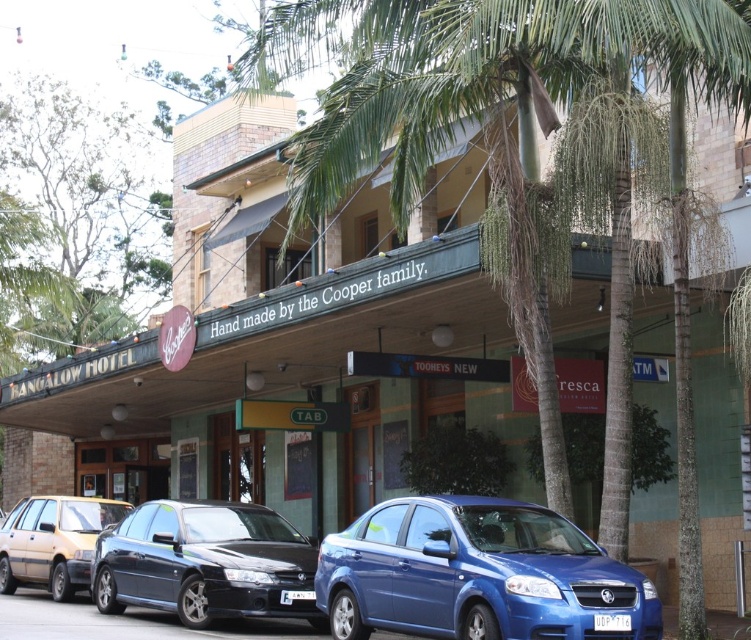
Question: Which point is farther to the camera?

Choices:
 (A) white plastic license plate at center
 (B) white plastic license plate at lower center
 (C) glossy blue sedan at lower center

Answer: (A)

Question: Observing the image, what is the correct spatial positioning of green leafy palm tree at center in reference to matte beige sedan at lower left?

Choices:
 (A) below
 (B) above

Answer: (B)

Question: Which of the following is the farthest from the observer?

Choices:
 (A) (154, 577)
 (B) (572, 120)
 (C) (311, 589)
 (D) (614, 618)

Answer: (A)

Question: Is green leafy palm tree at center wider than white plastic license plate at lower center?

Choices:
 (A) yes
 (B) no

Answer: (A)

Question: Which point appears farthest from the camera in this image?

Choices:
 (A) (252, 602)
 (B) (300, 600)
 (C) (44, 508)
 (D) (617, 627)

Answer: (C)

Question: From the image, what is the correct spatial relationship of green leafy palm tree at center in relation to white plastic license plate at lower center?

Choices:
 (A) left
 (B) right

Answer: (A)